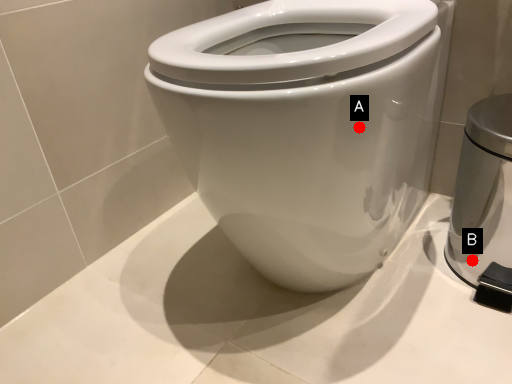
Question: Two points are circled on the image, labeled by A and B beside each circle. Which point is farther to the camera?

Choices:
 (A) A is further
 (B) B is further

Answer: (B)